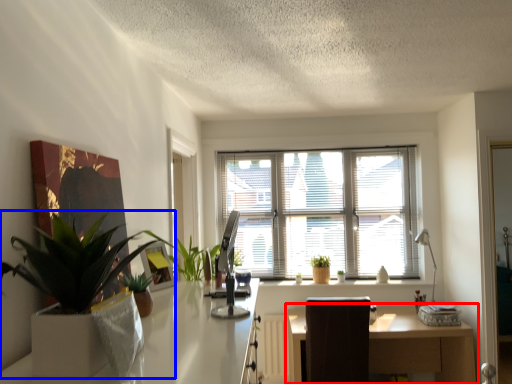
Question: Among these objects, which one is nearest to the camera, table (highlighted by a red box) or houseplant (highlighted by a blue box)?

Choices:
 (A) table
 (B) houseplant

Answer: (B)